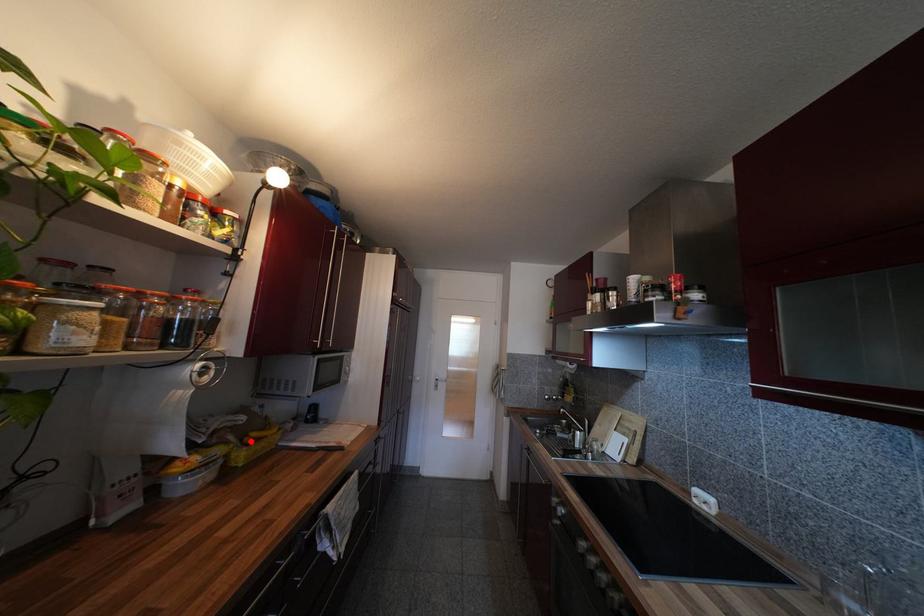
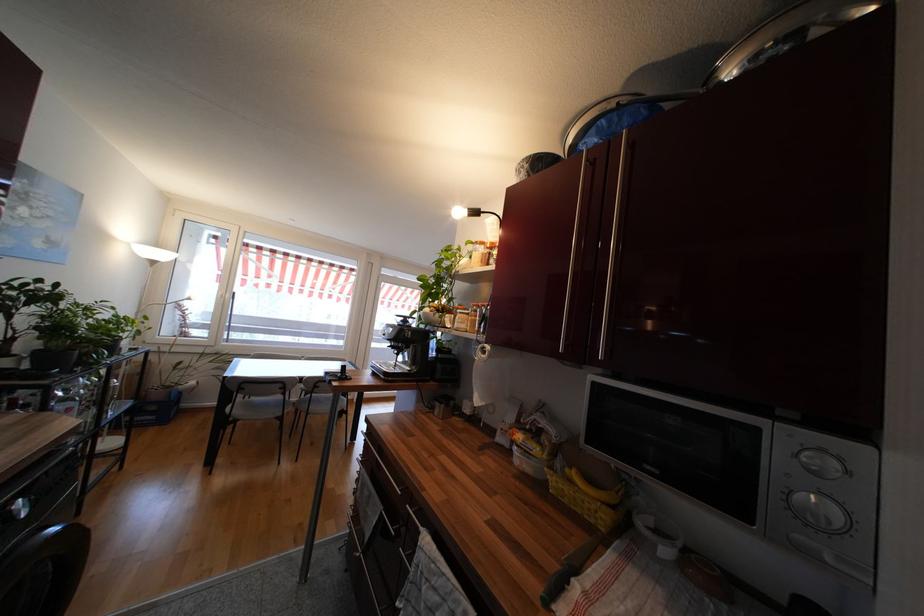
In the second image, find the point that corresponds to the highlighted location in the first image.

(572, 472)